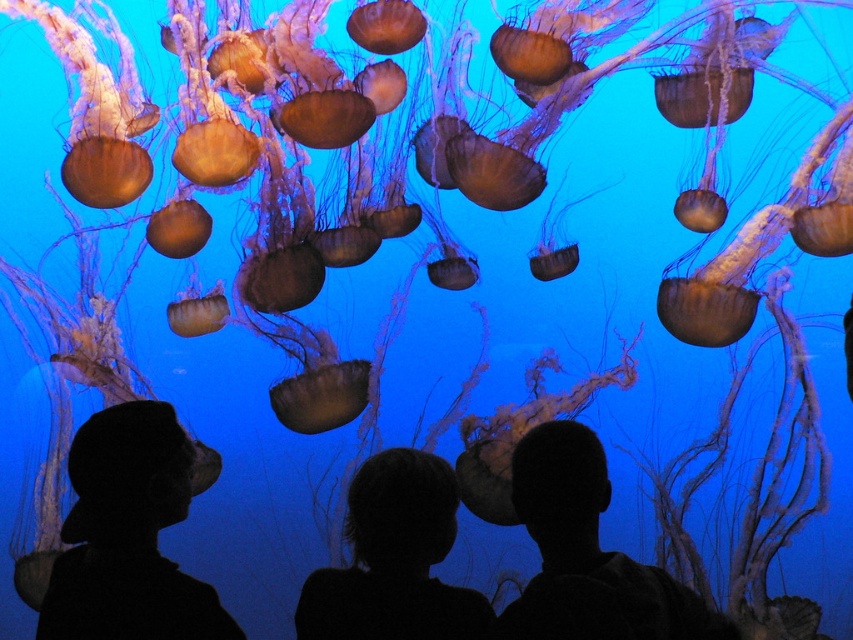
You are a photographer trying to capture the perfect shot of the two points in the aquarium scene. Which point, point (169, 506) or point (405, 595), is closer to your camera lens?

Point (169, 506) is closer to the camera lens than point (405, 595).

You are a photographer trying to capture a clear shot of the silhouette hat at lower left and the silhouette head at center. Since you can only focus on one object at a time, which one should you choose to ensure it fits entirely within your camera frame? Explain your reasoning based on their sizes.

The silhouette hat at lower left has a smaller width than the silhouette head at center. Therefore, to ensure it fits entirely within the camera frame, you should focus on the silhouette hat at lower left.